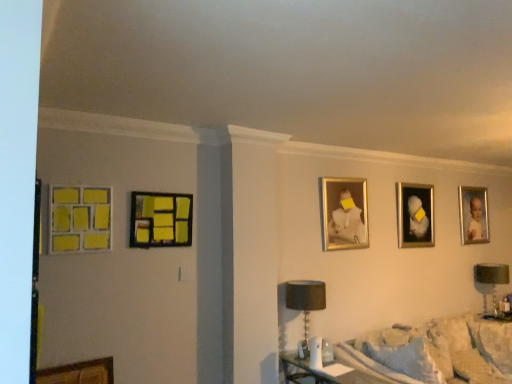
Question: In terms of width, does matte yellow tiles at left, the 1th picture frame viewed from the left, look wider or thinner when compared to gold-framed portrait at upper right, marked as the 5th picture frame in a front-to-back arrangement?

Choices:
 (A) wide
 (B) thin

Answer: (A)

Question: From the image's perspective, is matte yellow tiles at left, the 1th picture frame viewed from the left, positioned above or below gold-framed portrait at upper right, arranged as the 1th picture frame when viewed from the right?

Choices:
 (A) above
 (B) below

Answer: (A)

Question: Which is farther from the green fabric lampshade at right, acting as the second table lamp starting from the left?

Choices:
 (A) matte yellow tiles at left, the fifth picture frame viewed from the back
 (B) gold-framed portrait at upper right, positioned as the 4th picture frame in left-to-right order
 (C) gold-framed portrait at upper right, marked as the 5th picture frame in a front-to-back arrangement
 (D) matte wood picture frame at left, the 2th picture frame in the left-to-right sequence
 (E) fluffy white blanket at lower right

Answer: (A)

Question: Based on their relative distances, which object is nearer to the gold-framed portrait at upper right, positioned as the fifth picture frame in left-to-right order?

Choices:
 (A) matte yellow tiles at left, acting as the 5th picture frame starting from the right
 (B) black fabric lampshade at lower center, the 1th table lamp in the front-to-back sequence
 (C) green fabric lampshade at right, the first table lamp viewed from the back
 (D) gold-framed portrait at upper right, which appears as the 4th picture frame when viewed from the front
 (E) matte wood picture frame at left, the 2th picture frame in the left-to-right sequence

Answer: (C)